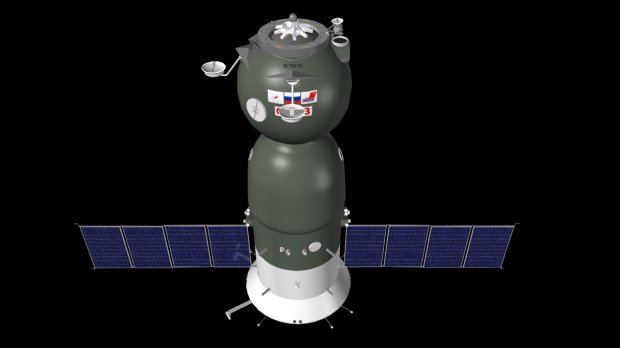
Find the location of `panels on the right`. panels on the right is located at coordinates (373, 246), (410, 245), (436, 245), (483, 245).